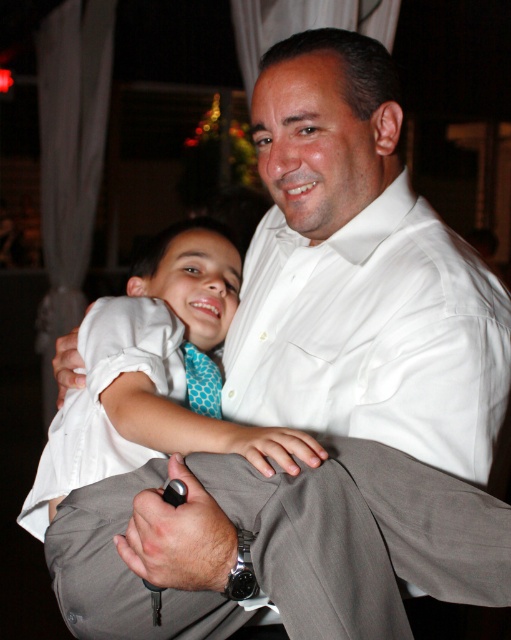
You are a photographer setting up for a family portrait. You need to ensure that the white cotton dress at center and the blue dotted tie at center are both visible in the frame. Given their sizes, which one might require more careful positioning to avoid being obscured?

The blue dotted tie at center is smaller in height compared to the white cotton dress at center, so it might require more careful positioning to ensure it remains visible and isn not overshadowed by the dress.

Looking at this image, you are a photographer who wants to ensure both the white smooth dress shirt at center and the white cotton shirt at center are clearly visible in the photo. Since the background is slightly out of focus, which shirt should you adjust your camera focus on to prioritize the one closer to the lens?

The white cotton shirt at center is closer to the lens than the white smooth dress shirt at center to its right, so focus on the white cotton shirt at center to ensure it is sharp.